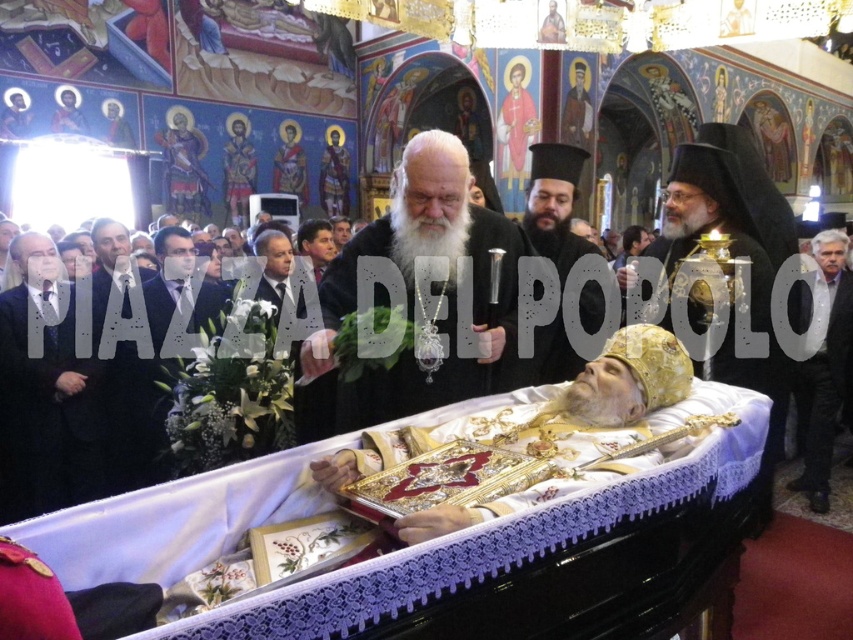
Question: Is black velvet hat at center thinner than matte black suit at center?

Choices:
 (A) yes
 (B) no

Answer: (B)

Question: Which object appears closest to the camera in this image?

Choices:
 (A) black suit at left
 (B) gray wool suit at right

Answer: (A)

Question: In this image, where is gold ornate robe at center located relative to matte black suit at center?

Choices:
 (A) above
 (B) below

Answer: (A)

Question: Which point is closer to the camera?

Choices:
 (A) (51, 376)
 (B) (444, 392)
 (C) (154, 435)

Answer: (B)

Question: Estimate the real-world distances between objects in this image. Which object is farther from the gold ornate robe at center?

Choices:
 (A) dark gray suit at center
 (B) matte black suit at center
 (C) black velvet hat at center

Answer: (A)

Question: Can you confirm if white bearded priest at center is positioned to the right of gray wool suit at right?

Choices:
 (A) no
 (B) yes

Answer: (A)